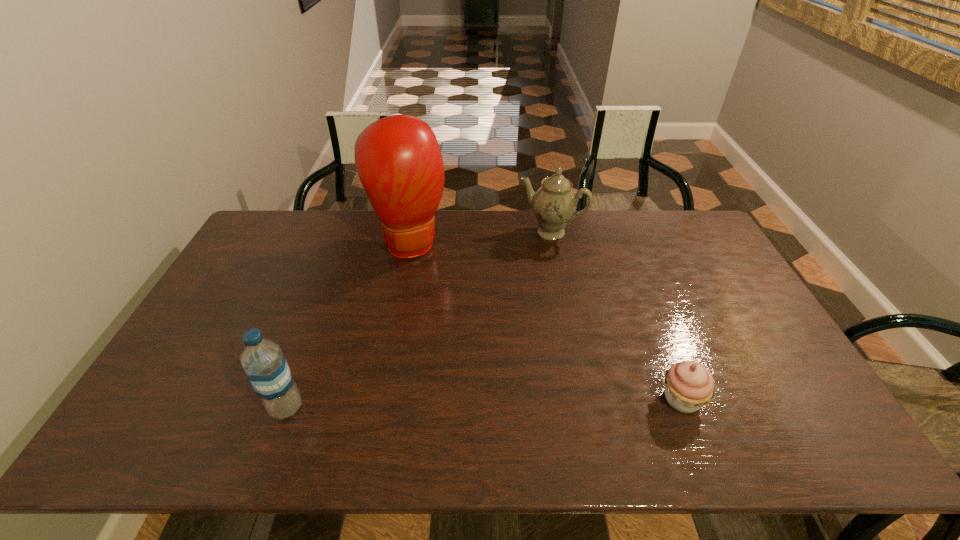
Find the location of a particular element. This screenshot has height=540, width=960. free space between the boxing glove and the second object from right to left is located at coordinates (481, 237).

Identify the location of vacant space that is in between the cupcake and the third object from left to right. (616, 316).

Choose which object is the third nearest neighbor to the shortest object. Please provide its 2D coordinates. Your answer should be formatted as a tuple, i.e. [(x, y)], where the tuple contains the x and y coordinates of a point satisfying the conditions above.

[(264, 363)]

Point out which object is positioned as the second nearest to the leftmost object. Please provide its 2D coordinates. Your answer should be formatted as a tuple, i.e. [(x, y)], where the tuple contains the x and y coordinates of a point satisfying the conditions above.

[(554, 204)]

What are the coordinates of `vacant space that satisfies the following two spatial constraints: 1. on the front side of the cupcake; 2. on the right side of the chinaware` in the screenshot? It's located at pyautogui.click(x=584, y=399).